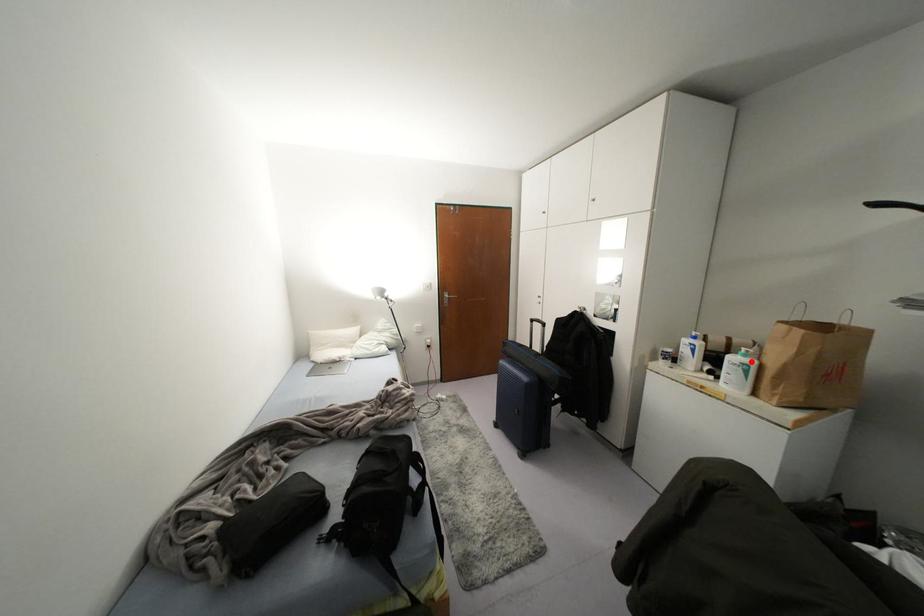
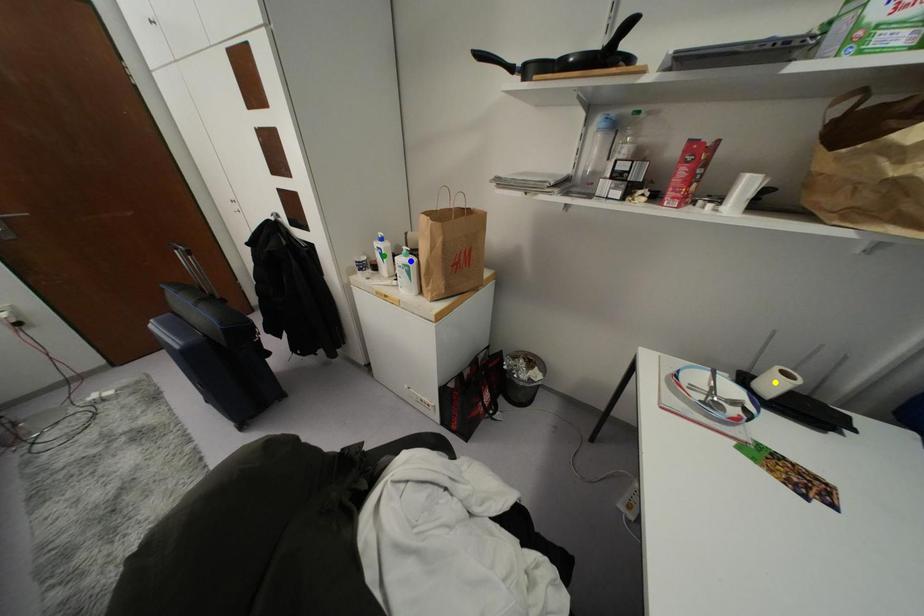
Question: I am providing you with two images of the same scene from different viewpoints. A red point is marked on the first image. You are given multiple points on the second image. Can you choose the point in image 2 that corresponds to the point in image 1?

Choices:
 (A) blue point
 (B) green point
 (C) yellow point

Answer: (A)